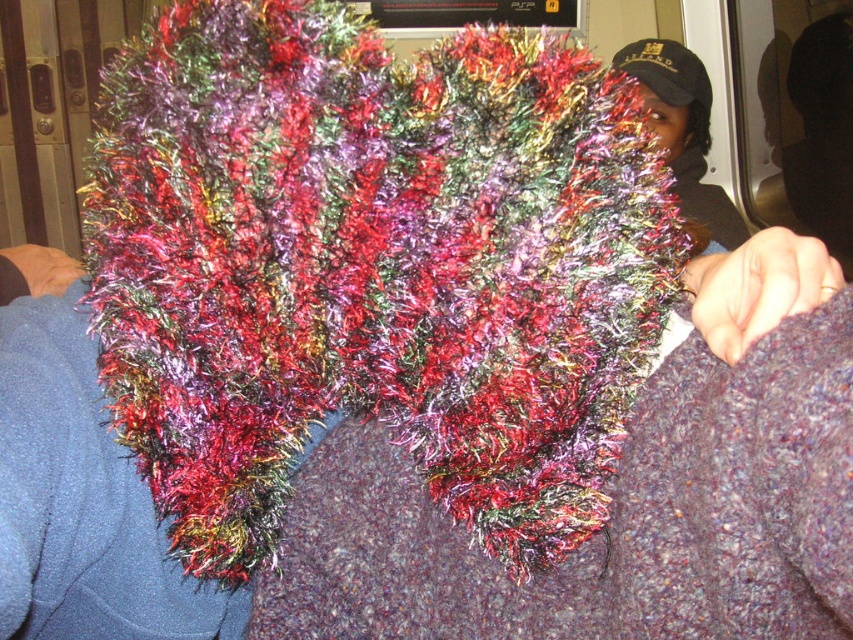
Based on the photo, you are a photographer trying to capture a candid shot of the black textured cap at upper right without the shiny multicolored scarf at center getting in the way. Given the distance between them, can you position yourself so that the scarf is completely out of the frame while still capturing the cap?

The shiny multicolored scarf at center is 1.84 meters away from the black textured cap at upper right. Since the distance is relatively large, you can position yourself far enough from the subjects so that the scarf is out of the frame while still capturing the cap in the shot.

You are a fashion designer observing the two items in the image. The shiny multicolored scarf at center and the black textured cap at upper right. Which of these two items is wider?

→ The shiny multicolored scarf at center is wider than the black textured cap at upper right.